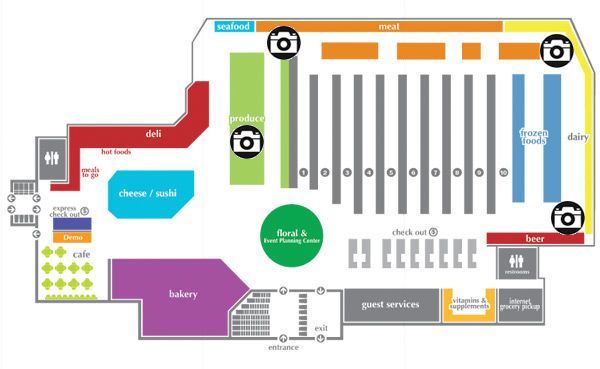
Identify the location of shelves. (292, 150), (314, 154), (337, 155), (355, 155), (382, 155), (403, 154), (421, 154), (447, 153), (469, 154), (488, 155).